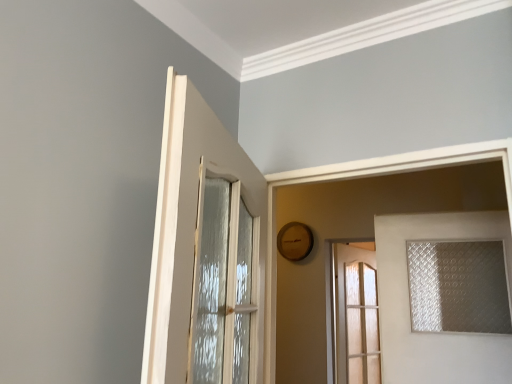
Question: Considering the relative positions of clear glass door at right, the third door in the left-to-right sequence, and translucent glass door at center, which is counted as the first door, starting from the back, in the image provided, is clear glass door at right, the third door in the left-to-right sequence, to the left or to the right of translucent glass door at center, which is counted as the first door, starting from the back,?

Choices:
 (A) left
 (B) right

Answer: (B)

Question: Is clear glass door at right, the second door viewed from the back, wider or thinner than translucent glass door at center, which appears as the second door when viewed from the left?

Choices:
 (A) thin
 (B) wide

Answer: (B)

Question: Estimate the real-world distances between objects in this image. Which object is closer to the clear glass door at right, the 2th door in the front-to-back sequence?

Choices:
 (A) translucent glass door at center, which appears as the second door when viewed from the left
 (B) white glossy door at upper left, placed as the third door when sorted from back to front
 (C) translucent frosted glass window at right

Answer: (C)

Question: Which is nearer to the clear glass door at right, the 2th door in the front-to-back sequence?

Choices:
 (A) translucent glass door at center, which is counted as the first door, starting from the back
 (B) white glossy door at upper left, placed as the third door when sorted from back to front
 (C) translucent frosted glass window at right

Answer: (C)